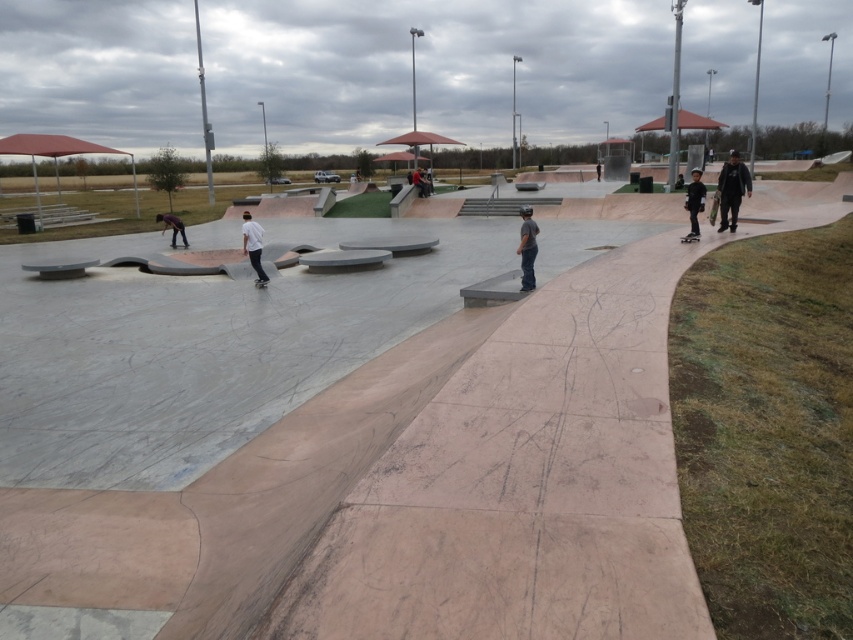
Is white matte shirt at center thinner than black matte skateboard at right?

In fact, white matte shirt at center might be wider than black matte skateboard at right.

Does white matte shirt at center have a lesser height compared to black matte skateboard at right?

No.

Does point (260, 234) lie behind point (694, 193)?

No, it is in front of (694, 193).

Locate an element on the screen. white matte shirt at center is located at coordinates (253, 244).

Looking at this image, does shiny purple skateboard at lower left appear on the right side of green matte skateboard at right?

No, shiny purple skateboard at lower left is not to the right of green matte skateboard at right.

Does point (180, 221) lie behind point (715, 200)?

Yes, point (180, 221) is farther from viewer.

Is point (187, 246) less distant than point (711, 218)?

No, (187, 246) is further to viewer.

This screenshot has height=640, width=853. What are the coordinates of `shiny purple skateboard at lower left` in the screenshot? It's located at (172, 227).

The image size is (853, 640). What do you see at coordinates (253, 244) in the screenshot?
I see `white matte shirt at center` at bounding box center [253, 244].

Measure the distance between point (253, 269) and camera.

Point (253, 269) is 48.95 feet away from camera.

Find the location of a particular element. The height and width of the screenshot is (640, 853). white matte shirt at center is located at coordinates pyautogui.click(x=253, y=244).